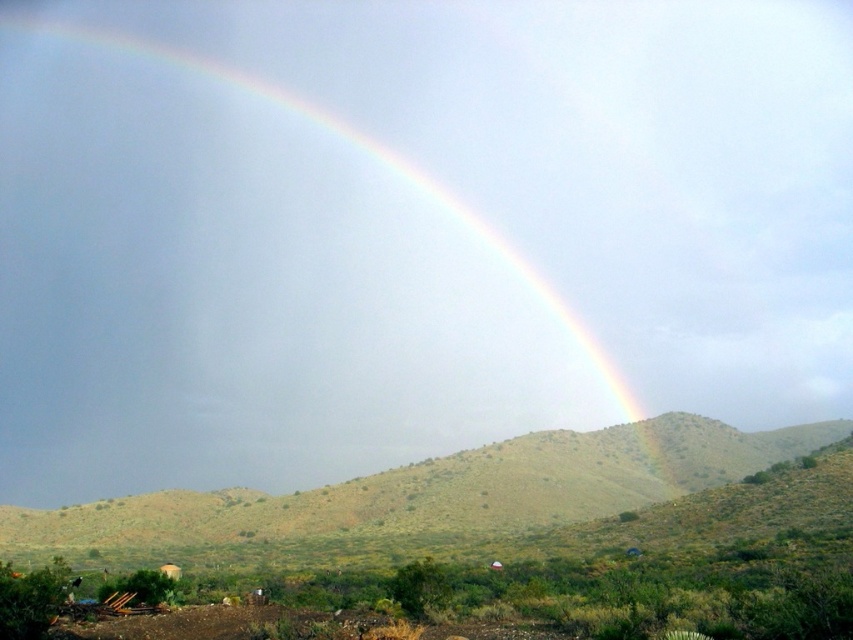
Question: Which object is farther from the camera taking this photo?

Choices:
 (A) rainbow at upper center
 (B) green grassy hillside at lower center

Answer: (A)

Question: Can you confirm if rainbow at upper center is positioned below green grassy hillside at lower center?

Choices:
 (A) yes
 (B) no

Answer: (B)

Question: Considering the relative positions of rainbow at upper center and green grassy hillside at lower center in the image provided, where is rainbow at upper center located with respect to green grassy hillside at lower center?

Choices:
 (A) right
 (B) left

Answer: (B)

Question: Does rainbow at upper center come behind green grassy hillside at lower center?

Choices:
 (A) yes
 (B) no

Answer: (A)

Question: Which point is farther to the camera?

Choices:
 (A) (64, 388)
 (B) (787, 460)

Answer: (A)